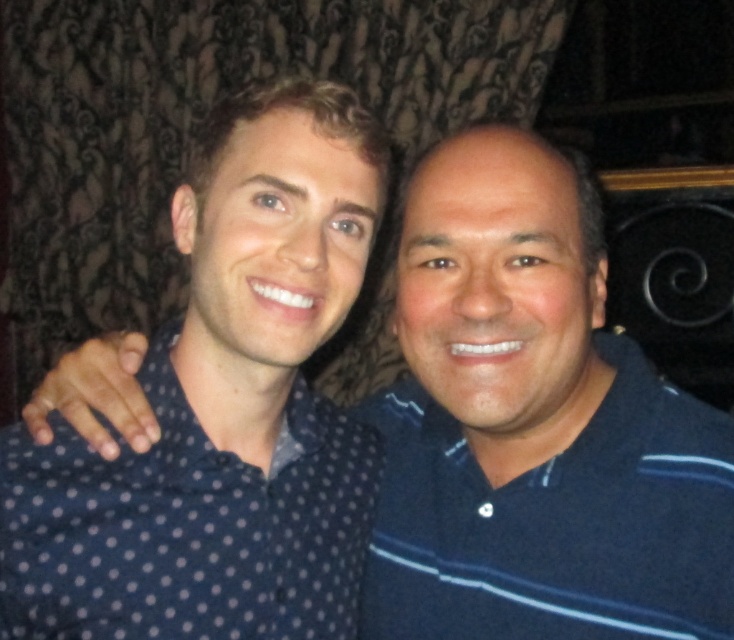
You are trying to identify the two people in the image. You know that the person wearing the blue striped polo shirt at right is standing to the right of the person in the dark blue polka dot shirt at left. Based on their positions, which shirt is worn by the person closer to the camera?

The blue striped polo shirt at right is positioned on the right side of the dark blue polka dot shirt at left, so the person wearing the blue striped polo shirt at right is further away from the camera compared to the person in the dark blue polka dot shirt at left. Therefore, the dark blue polka dot shirt at left is closer to the camera.

You are a photographer adjusting the camera focus. The two subjects are wearing the blue striped polo shirt at right and the dark blue polka dot shirt at left. If the camera can only focus on objects within a 5 inch range, will both shirts be in focus?

The blue striped polo shirt at right is 6.35 inches away from the dark blue polka dot shirt at left. Since the distance between them exceeds the 5 inch focus range, the camera cannot keep both shirts in focus simultaneously.

In the scene shown: You are taking a photo of two people wearing shirts. The person on the left has a dark blue polka dot shirt at left and the person on the right has a blue striped polo shirt at right. Which shirt is positioned lower in the image?

The blue striped polo shirt at right is positioned below the dark blue polka dot shirt at left, so the blue striped polo shirt at right is lower in the image.